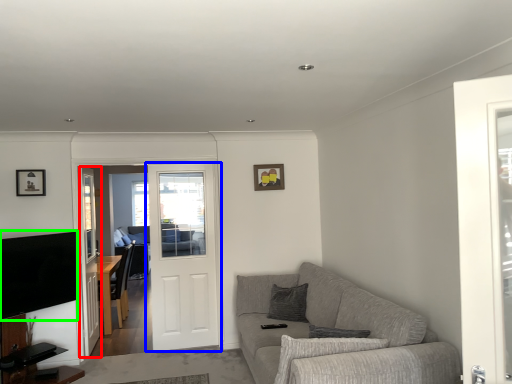
Question: Based on their relative distances, which object is nearer to screen door (highlighted by a red box)? Choose from door (highlighted by a blue box) and television (highlighted by a green box).

Choices:
 (A) door
 (B) television

Answer: (B)